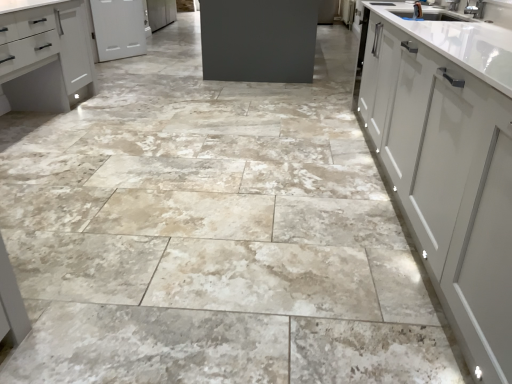
This screenshot has width=512, height=384. In order to click on white matte cabinet at upper left, arranged as the 1th cabinetry when viewed from the back in this screenshot , I will do `click(118, 28)`.

Image resolution: width=512 pixels, height=384 pixels. Describe the element at coordinates (118, 28) in the screenshot. I see `white matte cabinet at upper left, the second cabinetry from the front` at that location.

At what (x,y) coordinates should I click in order to perform the action: click on matte white cabinet at left, arranged as the first cabinetry when viewed from the front. Please return your answer as a coordinate pair (x, y). This screenshot has height=384, width=512. Looking at the image, I should click on (45, 56).

What do you see at coordinates (45, 56) in the screenshot? I see `matte white cabinet at left, arranged as the first cabinetry when viewed from the front` at bounding box center [45, 56].

At what (x,y) coordinates should I click in order to perform the action: click on white matte cabinet at upper left, the second cabinetry from the front. Please return your answer as a coordinate pair (x, y). Looking at the image, I should click on (118, 28).

Considering the relative positions of white matte cabinet at upper left, marked as the first cabinetry in a top-to-bottom arrangement, and matte white cabinet at left, which ranks as the 2th cabinetry in back-to-front order, in the image provided, is white matte cabinet at upper left, marked as the first cabinetry in a top-to-bottom arrangement, to the left of matte white cabinet at left, which ranks as the 2th cabinetry in back-to-front order, from the viewer's perspective?

No.

Is white matte cabinet at upper left, arranged as the 1th cabinetry when viewed from the back, further to the viewer compared to matte white cabinet at left, which ranks as the 2th cabinetry in back-to-front order?

Yes, it is behind matte white cabinet at left, which ranks as the 2th cabinetry in back-to-front order.

Does point (105, 41) come behind point (4, 99)?

Yes, it is.

From the image's perspective, which one is positioned lower, white matte cabinet at upper left, marked as the first cabinetry in a top-to-bottom arrangement, or matte white cabinet at left, which appears as the first cabinetry when ordered from the bottom?

matte white cabinet at left, which appears as the first cabinetry when ordered from the bottom, is shown below in the image.

From a real-world perspective, which object rests below the other?

white matte cabinet at upper left, arranged as the 1th cabinetry when viewed from the back.

Between white matte cabinet at upper left, the second cabinetry from the front, and matte white cabinet at left, arranged as the first cabinetry when viewed from the front, which one has smaller width?

white matte cabinet at upper left, the second cabinetry from the front, is thinner.

Does white matte cabinet at upper left, marked as the first cabinetry in a top-to-bottom arrangement, have a lesser height compared to matte white cabinet at left, which ranks as the 2th cabinetry in back-to-front order?

Yes.

Is white matte cabinet at upper left, which is counted as the second cabinetry, starting from the bottom, smaller than matte white cabinet at left, arranged as the first cabinetry when viewed from the front?

Correct, white matte cabinet at upper left, which is counted as the second cabinetry, starting from the bottom, occupies less space than matte white cabinet at left, arranged as the first cabinetry when viewed from the front.

Is matte white cabinet at left, arranged as the first cabinetry when viewed from the front, a part of white matte cabinet at upper left, the second cabinetry from the front?

Actually, matte white cabinet at left, arranged as the first cabinetry when viewed from the front, is outside white matte cabinet at upper left, the second cabinetry from the front.

Consider the image. Are white matte cabinet at upper left, marked as the first cabinetry in a top-to-bottom arrangement, and matte white cabinet at left, which appears as the first cabinetry when ordered from the bottom, located far from each other?

white matte cabinet at upper left, marked as the first cabinetry in a top-to-bottom arrangement, is far away from matte white cabinet at left, which appears as the first cabinetry when ordered from the bottom.

Could you tell me if white matte cabinet at upper left, marked as the first cabinetry in a top-to-bottom arrangement, is facing matte white cabinet at left, which ranks as the 2th cabinetry in back-to-front order?

No, white matte cabinet at upper left, marked as the first cabinetry in a top-to-bottom arrangement, is not aimed at matte white cabinet at left, which ranks as the 2th cabinetry in back-to-front order.

How different are the orientations of white matte cabinet at upper left, marked as the first cabinetry in a top-to-bottom arrangement, and matte white cabinet at left, arranged as the first cabinetry when viewed from the front, in degrees?

There is a 32.5-degree angle between the facing directions of white matte cabinet at upper left, marked as the first cabinetry in a top-to-bottom arrangement, and matte white cabinet at left, arranged as the first cabinetry when viewed from the front.

This screenshot has width=512, height=384. I want to click on cabinetry located above the matte white cabinet at left, which ranks as the 2th cabinetry in back-to-front order (from the image's perspective), so click(x=118, y=28).

Based on their positions, is matte white cabinet at left, which appears as the first cabinetry when ordered from the bottom, located to the left or right of white matte cabinet at upper left, arranged as the 1th cabinetry when viewed from the back?

matte white cabinet at left, which appears as the first cabinetry when ordered from the bottom, is to the left of white matte cabinet at upper left, arranged as the 1th cabinetry when viewed from the back.

Which object is more forward, matte white cabinet at left, arranged as the first cabinetry when viewed from the front, or white matte cabinet at upper left, which is counted as the second cabinetry, starting from the bottom?

matte white cabinet at left, arranged as the first cabinetry when viewed from the front, is closer to the camera.

Considering the points (77, 31) and (103, 5), which point is behind, point (77, 31) or point (103, 5)?

Point (103, 5)

From the image's perspective, is matte white cabinet at left, which ranks as the 2th cabinetry in back-to-front order, on top of white matte cabinet at upper left, the second cabinetry from the front?

No, from the image's perspective, matte white cabinet at left, which ranks as the 2th cabinetry in back-to-front order, is not above white matte cabinet at upper left, the second cabinetry from the front.

From a real-world perspective, is matte white cabinet at left, arranged as the first cabinetry when viewed from the front, above or below white matte cabinet at upper left, which is counted as the second cabinetry, starting from the bottom?

matte white cabinet at left, arranged as the first cabinetry when viewed from the front, is situated higher than white matte cabinet at upper left, which is counted as the second cabinetry, starting from the bottom, in the real world.

Considering the sizes of objects matte white cabinet at left, which appears as the first cabinetry when ordered from the bottom, and white matte cabinet at upper left, which is counted as the second cabinetry, starting from the bottom, in the image provided, who is thinner, matte white cabinet at left, which appears as the first cabinetry when ordered from the bottom, or white matte cabinet at upper left, which is counted as the second cabinetry, starting from the bottom,?

white matte cabinet at upper left, which is counted as the second cabinetry, starting from the bottom, is thinner.

Which of these two, matte white cabinet at left, which ranks as the 2th cabinetry in back-to-front order, or white matte cabinet at upper left, the second cabinetry from the front, stands taller?

matte white cabinet at left, which ranks as the 2th cabinetry in back-to-front order, is taller.

Considering the sizes of objects matte white cabinet at left, which ranks as the 2th cabinetry in back-to-front order, and white matte cabinet at upper left, arranged as the 1th cabinetry when viewed from the back, in the image provided, who is smaller, matte white cabinet at left, which ranks as the 2th cabinetry in back-to-front order, or white matte cabinet at upper left, arranged as the 1th cabinetry when viewed from the back,?

white matte cabinet at upper left, arranged as the 1th cabinetry when viewed from the back, is smaller.

In the scene shown: Would you say matte white cabinet at left, which ranks as the 2th cabinetry in back-to-front order, is outside white matte cabinet at upper left, which is counted as the second cabinetry, starting from the bottom?

Yes, matte white cabinet at left, which ranks as the 2th cabinetry in back-to-front order, is outside of white matte cabinet at upper left, which is counted as the second cabinetry, starting from the bottom.

Would you consider matte white cabinet at left, the second cabinetry positioned from the top, to be distant from white matte cabinet at upper left, marked as the first cabinetry in a top-to-bottom arrangement?

Yes, matte white cabinet at left, the second cabinetry positioned from the top, is far from white matte cabinet at upper left, marked as the first cabinetry in a top-to-bottom arrangement.

Looking at this image, could you tell me if matte white cabinet at left, the second cabinetry positioned from the top, is facing white matte cabinet at upper left, arranged as the 1th cabinetry when viewed from the back?

No, matte white cabinet at left, the second cabinetry positioned from the top, is not aimed at white matte cabinet at upper left, arranged as the 1th cabinetry when viewed from the back.

How different are the orientations of matte white cabinet at left, which ranks as the 2th cabinetry in back-to-front order, and white matte cabinet at upper left, arranged as the 1th cabinetry when viewed from the back, in degrees?

The angular difference between matte white cabinet at left, which ranks as the 2th cabinetry in back-to-front order, and white matte cabinet at upper left, arranged as the 1th cabinetry when viewed from the back, is 32.5 degrees.

Identify the location of cabinetry that is in front of the white matte cabinet at upper left, the second cabinetry from the front. This screenshot has height=384, width=512. (45, 56).

You are a GUI agent. You are given a task and a screenshot of the screen. Output one action in this format:
    pyautogui.click(x=<x>, y=<y>)
    Task: Click on the cabinetry below the white matte cabinet at upper left, the second cabinetry from the front (from the image's perspective)
    The image size is (512, 384).
    Given the screenshot: What is the action you would take?
    pyautogui.click(x=45, y=56)

What are the coordinates of `cabinetry behind the matte white cabinet at left, the second cabinetry positioned from the top` in the screenshot? It's located at (118, 28).